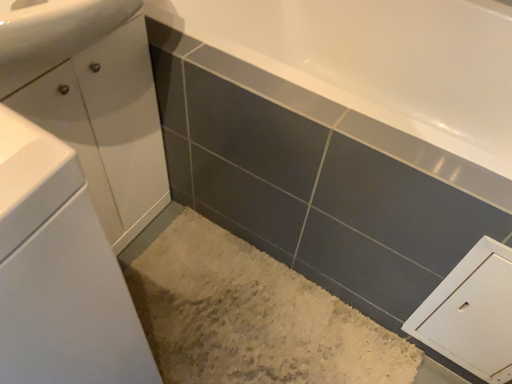
Question: Is white glossy cabinet at left, which ranks as the 2th bathroom cabinet in back-to-front order, closer to camera compared to white glossy cabinet at left, the 2th bathroom cabinet positioned from the front?

Choices:
 (A) yes
 (B) no

Answer: (A)

Question: Is white glossy cabinet at left, the 1th bathroom cabinet from the back, located within white glossy cabinet at left, the 1th bathroom cabinet when ordered from front to back?

Choices:
 (A) no
 (B) yes

Answer: (A)

Question: Can you confirm if white glossy cabinet at left, which ranks as the 2th bathroom cabinet in back-to-front order, is thinner than white glossy cabinet at left, the 1th bathroom cabinet from the back?

Choices:
 (A) yes
 (B) no

Answer: (B)

Question: From a real-world perspective, is white glossy cabinet at left, the 1th bathroom cabinet when ordered from front to back, under white glossy cabinet at left, the 1th bathroom cabinet from the back?

Choices:
 (A) no
 (B) yes

Answer: (A)

Question: Is white glossy cabinet at left, the 1th bathroom cabinet when ordered from front to back, touching white glossy cabinet at left, the 2th bathroom cabinet positioned from the front?

Choices:
 (A) no
 (B) yes

Answer: (A)

Question: Considering the relative positions of white glossy cabinet at left, which ranks as the 2th bathroom cabinet in back-to-front order, and white glossy cabinet at left, the 2th bathroom cabinet positioned from the front, in the image provided, is white glossy cabinet at left, which ranks as the 2th bathroom cabinet in back-to-front order, to the right of white glossy cabinet at left, the 2th bathroom cabinet positioned from the front, from the viewer's perspective?

Choices:
 (A) yes
 (B) no

Answer: (B)

Question: From a real-world perspective, is white glossy cabinet at left, the 1th bathroom cabinet from the back, positioned under white matte cabinet at lower right based on gravity?

Choices:
 (A) yes
 (B) no

Answer: (B)

Question: Is the position of white glossy cabinet at left, the 1th bathroom cabinet from the back, more distant than that of white matte cabinet at lower right?

Choices:
 (A) no
 (B) yes

Answer: (A)

Question: Can you confirm if white glossy cabinet at left, the 2th bathroom cabinet positioned from the front, is shorter than white matte cabinet at lower right?

Choices:
 (A) yes
 (B) no

Answer: (B)

Question: Can you confirm if white glossy cabinet at left, the 1th bathroom cabinet from the back, is wider than white matte cabinet at lower right?

Choices:
 (A) yes
 (B) no

Answer: (A)

Question: From the image's perspective, is white glossy cabinet at left, the 2th bathroom cabinet positioned from the front, beneath white matte cabinet at lower right?

Choices:
 (A) yes
 (B) no

Answer: (B)

Question: Are white glossy cabinet at left, the 1th bathroom cabinet from the back, and white matte cabinet at lower right making contact?

Choices:
 (A) yes
 (B) no

Answer: (B)

Question: Could you tell me if white matte cabinet at lower right is facing white glossy cabinet at left, the 1th bathroom cabinet from the back?

Choices:
 (A) yes
 (B) no

Answer: (B)